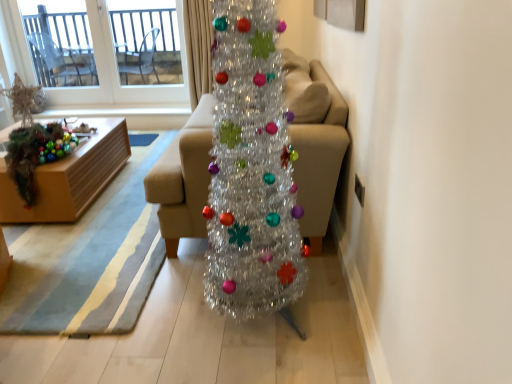
You are a GUI agent. You are given a task and a screenshot of the screen. Output one action in this format:
    pyautogui.click(x=<x>, y=<y>)
    Task: Click on the free space between beige fabric couch at center and shiny metallic christmas tree at center
    
    Given the screenshot: What is the action you would take?
    pyautogui.click(x=202, y=289)